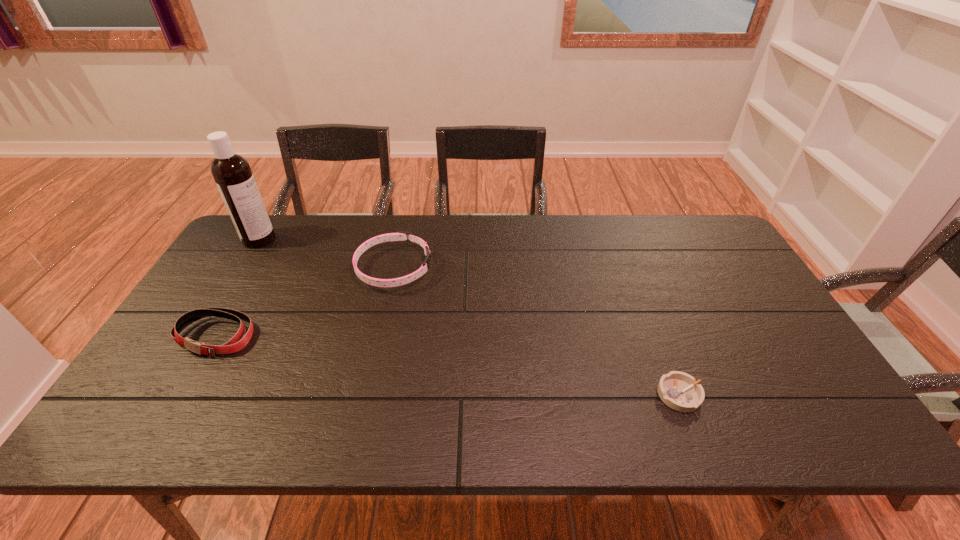
At what (x,y) coordinates should I click in order to perform the action: click on dishwasher detergent. Please return your answer as a coordinate pair (x, y). The image size is (960, 540). Looking at the image, I should click on (232, 173).

This screenshot has width=960, height=540. What are the coordinates of `the third farthest object` in the screenshot? It's located at (236, 343).

Locate an element on the screen. This screenshot has width=960, height=540. the left dog collar is located at coordinates (236, 343).

Find the location of `the third object from left to right`. the third object from left to right is located at coordinates (400, 235).

Where is `the right dog collar`? Image resolution: width=960 pixels, height=540 pixels. the right dog collar is located at coordinates (400, 235).

I want to click on the nearest object, so click(680, 391).

Identify the location of ashtray. Image resolution: width=960 pixels, height=540 pixels. (680, 391).

Identify the location of free space located 0.170m on the label side of the tallest object. (325, 239).

Identify the location of free space located 0.360m on the right of the nearer dog collar. (391, 336).

Where is `vacant space located with the buckle on the farther dog collar`? vacant space located with the buckle on the farther dog collar is located at coordinates (512, 268).